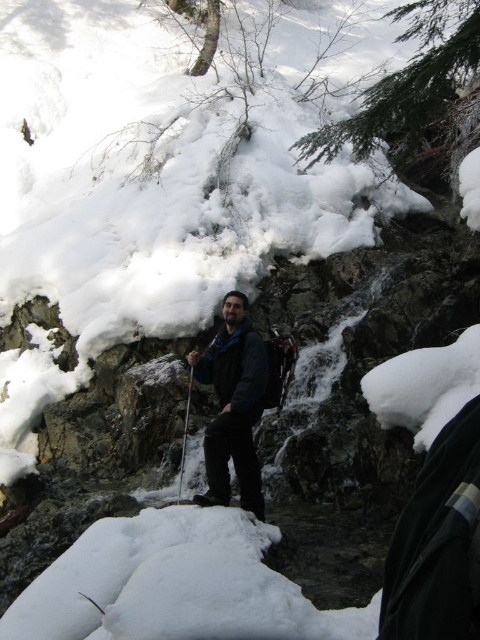
In the scene shown: Does dark blue jacket at center have a lesser height compared to metallic silver ski pole at center?

In fact, dark blue jacket at center may be taller than metallic silver ski pole at center.

Identify the location of dark blue jacket at center. (233, 404).

Does dark blue jacket at center have a lesser width compared to reddish-brown wooden ski pole at center?

No, dark blue jacket at center is not thinner than reddish-brown wooden ski pole at center.

The height and width of the screenshot is (640, 480). What do you see at coordinates (233, 404) in the screenshot?
I see `dark blue jacket at center` at bounding box center [233, 404].

The width and height of the screenshot is (480, 640). What are the coordinates of `dark blue jacket at center` in the screenshot? It's located at (233, 404).

Can you confirm if metallic silver ski pole at center is positioned above reddish-brown wooden ski pole at center?

Indeed, metallic silver ski pole at center is positioned over reddish-brown wooden ski pole at center.

Who is more distant from viewer, (x=208, y=342) or (x=189, y=376)?

The point (x=208, y=342) is more distant.

What are the coordinates of `metallic silver ski pole at center` in the screenshot? It's located at (184, 435).